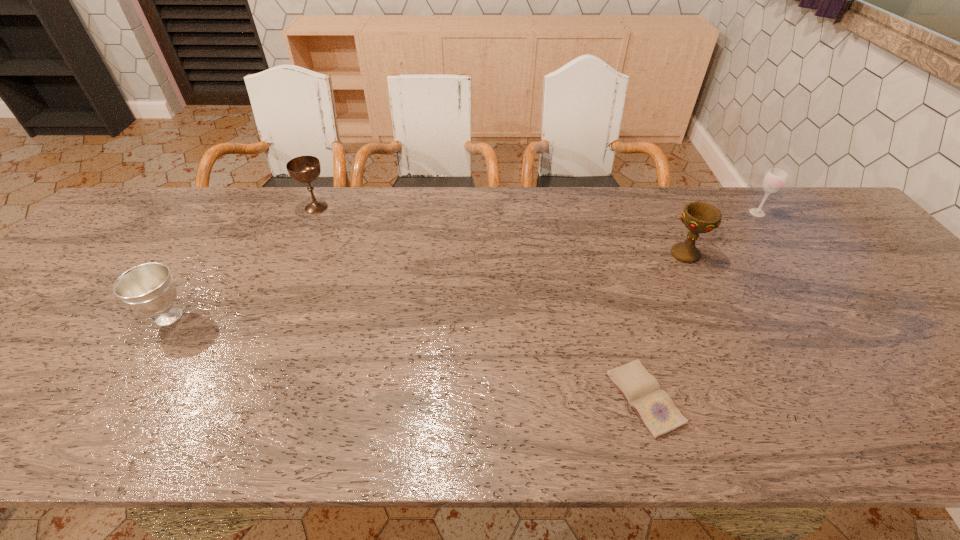
The image size is (960, 540). Identify the location of the second object from left to right. (304, 169).

What are the coordinates of `the farthest chalice` in the screenshot? It's located at (304, 169).

Where is `the second farthest chalice`? Image resolution: width=960 pixels, height=540 pixels. the second farthest chalice is located at coordinates (698, 217).

Locate an element on the screen. the second object from right to left is located at coordinates (698, 217).

Find the location of a particular element. This screenshot has width=960, height=540. the rightmost object is located at coordinates (774, 180).

Find the location of a particular element. This screenshot has height=540, width=960. the nearest chalice is located at coordinates (149, 288).

Find the location of `the leftmost chalice`. the leftmost chalice is located at coordinates pyautogui.click(x=149, y=288).

Locate an element on the screen. Image resolution: width=960 pixels, height=540 pixels. the third object from right to left is located at coordinates (655, 408).

At what (x,y) coordinates should I click in order to perform the action: click on the nearest object. Please return your answer as a coordinate pair (x, y). The image size is (960, 540). Looking at the image, I should click on (655, 408).

What are the coordinates of `free point located on the left of the second object from left to right` in the screenshot? It's located at (x=282, y=207).